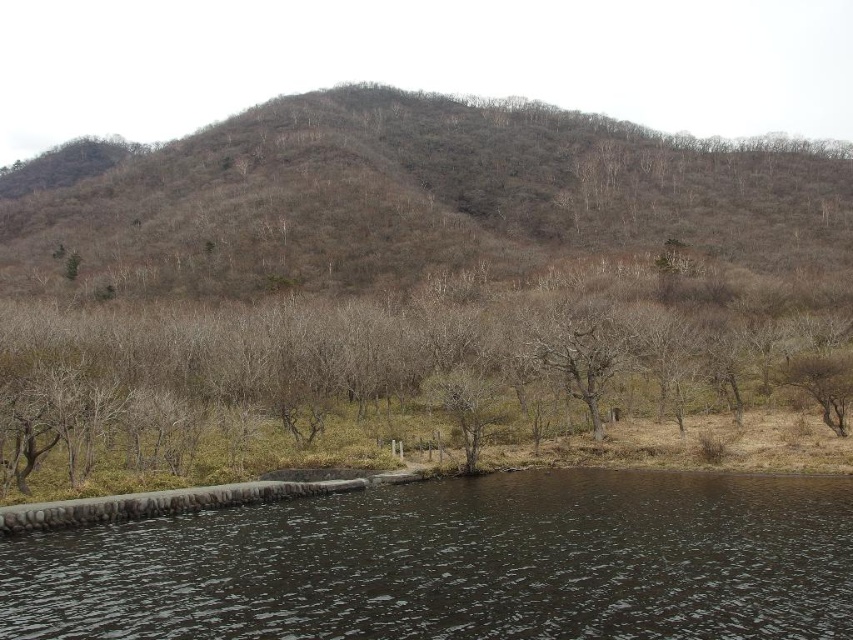
Is brown dry wood at center wider than dark water at lower center?

Correct, the width of brown dry wood at center exceeds that of dark water at lower center.

The height and width of the screenshot is (640, 853). In order to click on brown dry wood at center in this screenshot , I will do `click(393, 380)`.

Identify the location of brown dry wood at center. (393, 380).

Who is positioned more to the right, brown dry wood at center or brown/drymaterial/texture mountain at upper center?

From the viewer's perspective, brown dry wood at center appears more on the right side.

Does brown dry wood at center have a smaller size compared to brown/drymaterial/texture mountain at upper center?

Yes.

Does point (26, 326) lie behind point (312, 225)?

No, (26, 326) is in front of (312, 225).

You are a GUI agent. You are given a task and a screenshot of the screen. Output one action in this format:
    pyautogui.click(x=<x>, y=<y>)
    Task: Click on the brown dry wood at center
    Image resolution: width=853 pixels, height=640 pixels.
    Given the screenshot: What is the action you would take?
    pyautogui.click(x=393, y=380)

Between dark water at lower center and brown/drymaterial/texture mountain at upper center, which one is positioned lower?

Positioned lower is dark water at lower center.

Does dark water at lower center have a greater width compared to brown/drymaterial/texture mountain at upper center?

No, dark water at lower center is not wider than brown/drymaterial/texture mountain at upper center.

Locate an element on the screen. This screenshot has height=640, width=853. dark water at lower center is located at coordinates (457, 563).